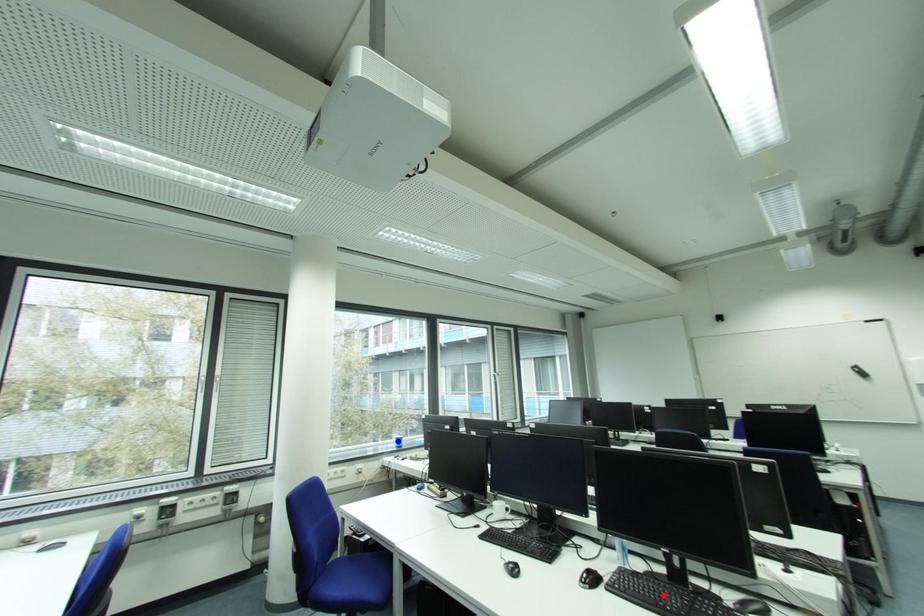
Question: In the image, two points are highlighted. Which point is nearer to the camera? Reply with the corresponding letter.

Choices:
 (A) blue point
 (B) red point

Answer: (B)